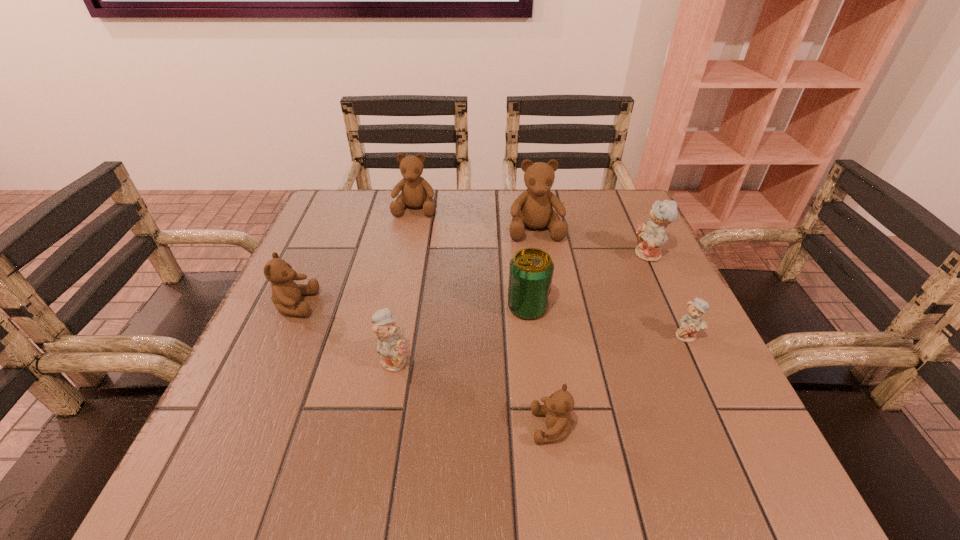
Where is `vacant space at the right edge of the desktop`? The width and height of the screenshot is (960, 540). vacant space at the right edge of the desktop is located at coordinates (652, 329).

Where is `blank space at the near left corner`? The height and width of the screenshot is (540, 960). blank space at the near left corner is located at coordinates (276, 450).

Locate an element on the screen. The width and height of the screenshot is (960, 540). vacant space at the far right corner of the desktop is located at coordinates (599, 222).

The height and width of the screenshot is (540, 960). Find the location of `free location at the near right corner`. free location at the near right corner is located at coordinates (763, 490).

Identify the location of vacant space in between the second biggest blue teddy bear and the third smallest brown teddy bear. (404, 284).

This screenshot has height=540, width=960. In order to click on free spot between the biggest blue teddy bear and the tallest teddy bear in this screenshot , I will do `click(591, 242)`.

Where is `empty location between the nearest object and the tallest object`? The height and width of the screenshot is (540, 960). empty location between the nearest object and the tallest object is located at coordinates (543, 328).

This screenshot has width=960, height=540. What are the coordinates of `free space between the biggest blue teddy bear and the second brown teddy bear from left to right` in the screenshot? It's located at (532, 232).

The height and width of the screenshot is (540, 960). I want to click on free space between the nearest object and the third nearest object, so click(x=619, y=381).

Identify the location of blank region between the second biggest brown teddy bear and the biggest brown teddy bear. This screenshot has width=960, height=540. (475, 219).